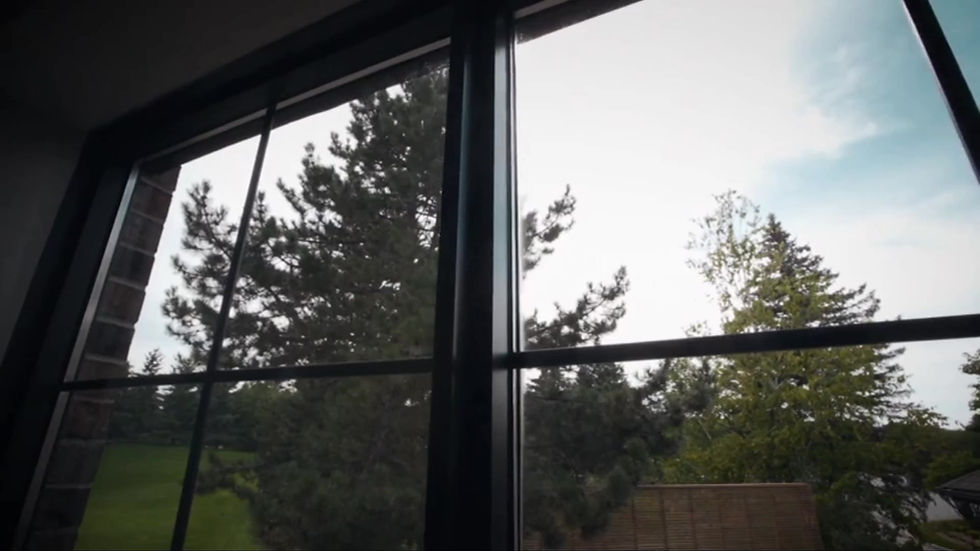
Image resolution: width=980 pixels, height=551 pixels. In order to click on pane dividers in this screenshot , I will do `click(189, 378)`, `click(220, 337)`, `click(548, 358)`, `click(972, 111)`.